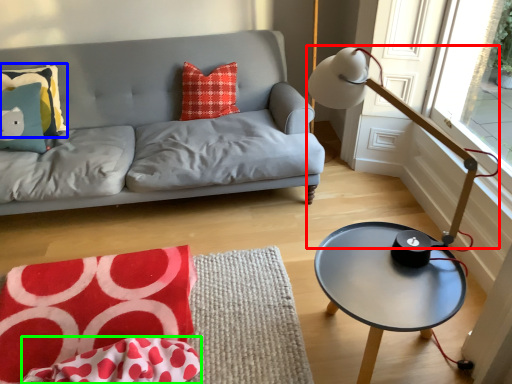
Question: Considering the real-world distances, which object is closest to table lamp (highlighted by a red box)? pillow (highlighted by a blue box) or material (highlighted by a green box).

Choices:
 (A) pillow
 (B) material

Answer: (B)